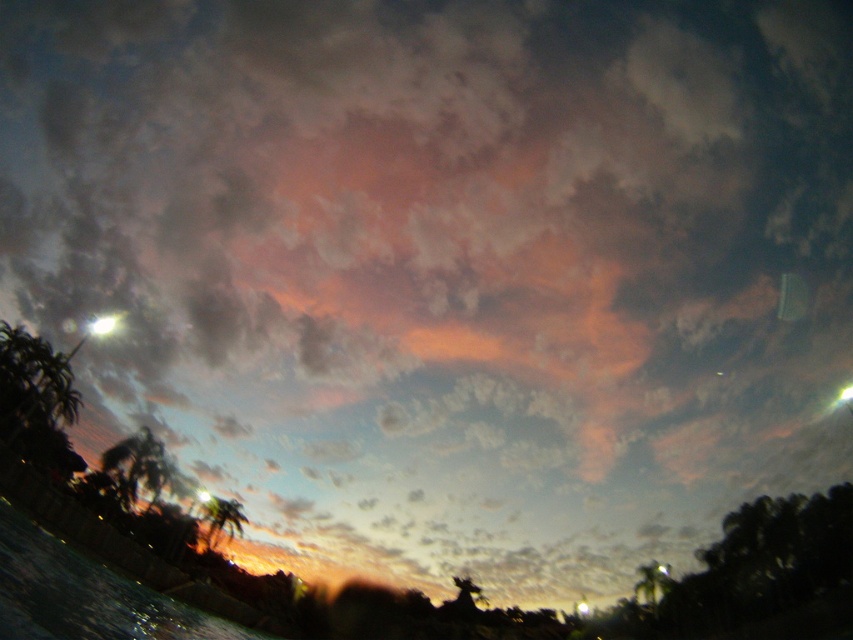
You are a photographer trying to capture the reflection of the palm tree in the water. Given the scene described, can you confirm if the translucent water at lower left is tall enough to reflect the green leafy palm tree at lower center?

The translucent water at lower left is much taller than the green leafy palm tree at lower center, so yes, the water is tall enough to reflect the green leafy palm tree at lower center.

You are a photographer standing at the edge of a beach, and you want to capture the translucent water at lower left and the green leafy palm tree at lower left in the same frame. Which object will occupy more space in your photo?

The translucent water at lower left is bigger than the green leafy palm tree at lower left, so it will occupy more space in the photo.